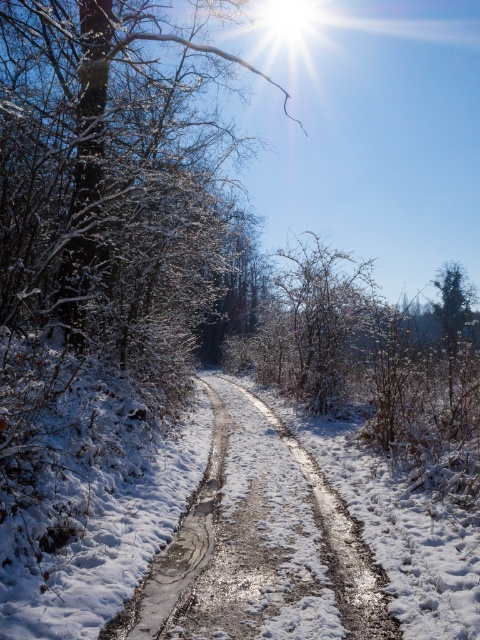
What do you see at coordinates (108, 172) in the screenshot? I see `white frosty tree at upper center` at bounding box center [108, 172].

Does point (210, 227) lie behind point (315, 500)?

That is True.

Is point (99, 212) positioned before point (155, 573)?

No, it is behind (155, 573).

Locate an element on the screen. The height and width of the screenshot is (640, 480). white frosty tree at upper center is located at coordinates (108, 172).